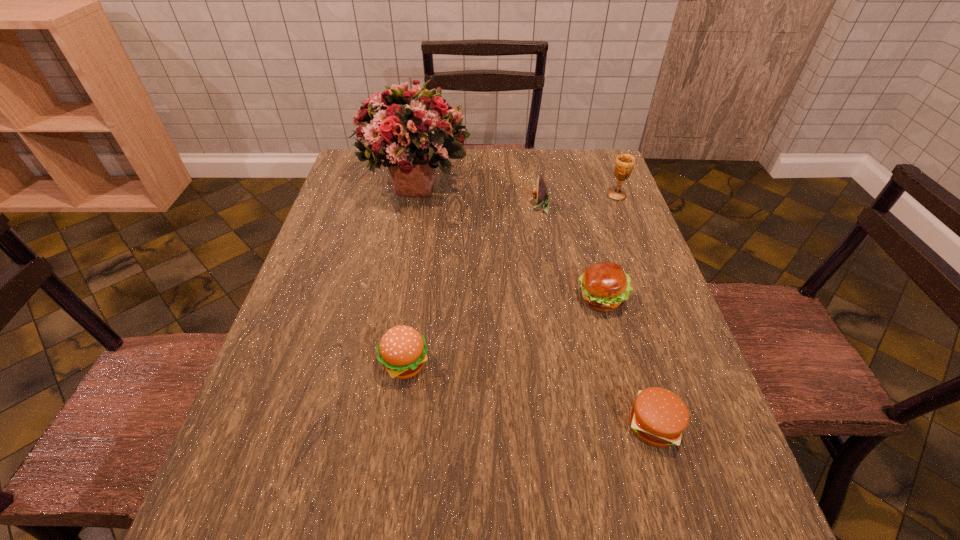
Find the location of a particular element. vacant space situated on the front of the chalice is located at coordinates (637, 252).

Where is `vacant space located 0.180m on the seed side of the avocado`? Image resolution: width=960 pixels, height=540 pixels. vacant space located 0.180m on the seed side of the avocado is located at coordinates (470, 207).

Find the location of a particular element. Image resolution: width=960 pixels, height=540 pixels. vacant region located 0.110m on the seed side of the avocado is located at coordinates click(x=493, y=207).

You are a GUI agent. You are given a task and a screenshot of the screen. Output one action in this format:
    pyautogui.click(x=<x>, y=<y>)
    Task: Click on the free point located 0.070m on the seed side of the avocado
    
    Given the screenshot: What is the action you would take?
    pyautogui.click(x=507, y=207)

The image size is (960, 540). Find the location of `free spot located on the right of the second nearest object`. free spot located on the right of the second nearest object is located at coordinates (607, 365).

Image resolution: width=960 pixels, height=540 pixels. I want to click on blank area located on the left of the farthest hamburger, so click(x=485, y=299).

You are a GUI agent. You are given a task and a screenshot of the screen. Output one action in this format:
    pyautogui.click(x=<x>, y=<y>)
    Task: Click on the vacant space situated 0.290m on the left of the nearest hamburger
    
    Given the screenshot: What is the action you would take?
    pyautogui.click(x=470, y=425)

I want to click on object that is at the far edge, so click(414, 132).

Where is `object that is at the left edge`? object that is at the left edge is located at coordinates (414, 132).

You are a GUI agent. You are given a task and a screenshot of the screen. Output one action in this format:
    pyautogui.click(x=<x>, y=<y>)
    Task: Click on the chalice situated at the right edge
    The image size is (960, 540).
    Given the screenshot: What is the action you would take?
    click(624, 164)